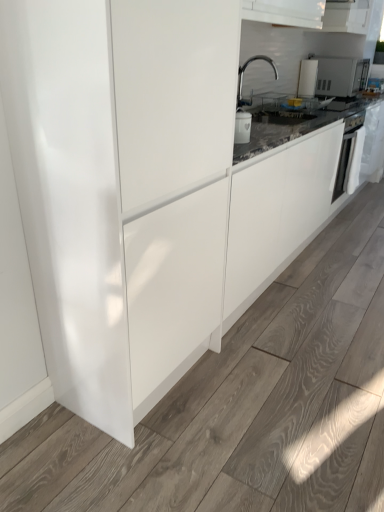
Measure the distance between point (303, 79) and camera.

They are 3.33 meters apart.

What do you see at coordinates (332, 75) in the screenshot? I see `white glossy microwave at upper right` at bounding box center [332, 75].

You are a GUI agent. You are given a task and a screenshot of the screen. Output one action in this format:
    pyautogui.click(x=<x>, y=<y>)
    Task: Click on the polished chrome faucet at upper center
    
    Given the screenshot: What is the action you would take?
    pyautogui.click(x=243, y=75)

At what (x,y) coordinates should I click in order to perform the action: click on white glossy oven at right. Please return your answer as a coordinate pair (x, y). Looking at the image, I should click on (346, 154).

What is the approximate width of glossy white cabinet at center?

A: It is 23.48 inches.

Locate an element on the screen. This screenshot has height=512, width=384. white glossy microwave at upper right is located at coordinates (307, 78).

Is polished chrome faucet at upper center oriented away from white glossy microwave at upper right?

polished chrome faucet at upper center is not turned away from white glossy microwave at upper right.

Is white glossy microwave at upper right a part of polished chrome faucet at upper center?

No, white glossy microwave at upper right is not surrounded by polished chrome faucet at upper center.

Considering the relative sizes of polished chrome faucet at upper center and white glossy microwave at upper right in the image provided, is polished chrome faucet at upper center bigger than white glossy microwave at upper right?

Yes.

Is white glossy microwave at upper right oriented towards glossy white cabinet at center?

No, white glossy microwave at upper right is not turned towards glossy white cabinet at center.

Can you confirm if white glossy microwave at upper right is shorter than glossy white cabinet at center?

Indeed, white glossy microwave at upper right has a lesser height compared to glossy white cabinet at center.

In the scene shown: How many degrees apart are the facing directions of white glossy microwave at upper right and glossy white cabinet at center?

There is a 1.13-degree angle between the facing directions of white glossy microwave at upper right and glossy white cabinet at center.

From the image's perspective, is white glossy microwave at upper right positioned above or below glossy white cabinet at center?

From the image's perspective, white glossy microwave at upper right appears above glossy white cabinet at center.

Considering their positions, is white glossy microwave at upper right located in front of or behind white glossy oven at right?

white glossy microwave at upper right is positioned farther from the viewer than white glossy oven at right.

Can you tell me how much white glossy microwave at upper right and white glossy oven at right differ in facing direction?

The facing directions of white glossy microwave at upper right and white glossy oven at right are 0.153 degrees apart.

Is white glossy microwave at upper right positioned far away from white glossy oven at right?

white glossy microwave at upper right is actually quite close to white glossy oven at right.

Could you tell me if white glossy microwave at upper right is facing white glossy oven at right?

No, white glossy microwave at upper right is not facing towards white glossy oven at right.

From the image's perspective, is glossy white cabinet at center above white glossy microwave at upper right?

No, from the image's perspective, glossy white cabinet at center is not above white glossy microwave at upper right.

Which of these two, glossy white cabinet at center or white glossy microwave at upper right, stands shorter?

white glossy microwave at upper right is shorter.

Identify the location of kitchen appliance that is above the glossy white cabinet at center (from a real-world perspective). This screenshot has height=512, width=384. (307, 78).

Is glossy white cabinet at center turned away from white glossy microwave at upper right?

No, glossy white cabinet at center is not facing away from white glossy microwave at upper right.

Considering the positions of point (332, 202) and point (346, 69), is point (332, 202) closer or farther from the camera than point (346, 69)?

Point (332, 202) appears to be closer to the viewer than point (346, 69).

From a real-world perspective, is white glossy oven at right physically above white glossy microwave at upper right?

No, from a real-world perspective, white glossy oven at right is not above white glossy microwave at upper right.

Is white glossy oven at right positioned far away from white glossy microwave at upper right?

white glossy oven at right is near white glossy microwave at upper right, not far away.

How different are the orientations of white glossy oven at right and white glossy microwave at upper right in degrees?

The facing directions of white glossy oven at right and white glossy microwave at upper right are 0.153 degrees apart.

Could you tell me if polished chrome faucet at upper center is facing white glossy oven at right?

No, polished chrome faucet at upper center is not aimed at white glossy oven at right.

The image size is (384, 512). Identify the location of home appliance on the right of polished chrome faucet at upper center. (346, 154).

From the image's perspective, is polished chrome faucet at upper center beneath white glossy oven at right?

No, from the image's perspective, polished chrome faucet at upper center is not below white glossy oven at right.

Locate an element on the screen. glass door that is on the left side of white glossy microwave at upper right is located at coordinates (70, 198).

Is white glossy microwave at upper right to the left of glossy white cabinet at center from the viewer's perspective?

No, white glossy microwave at upper right is not to the left of glossy white cabinet at center.

In terms of size, does white glossy microwave at upper right appear bigger or smaller than glossy white cabinet at center?

Considering their sizes, white glossy microwave at upper right takes up less space than glossy white cabinet at center.

Between white glossy microwave at upper right and glossy white cabinet at center, which one has smaller width?

Thinner between the two is white glossy microwave at upper right.

The image size is (384, 512). I want to click on tap that appears below the white glossy microwave at upper right (from the image's perspective), so click(x=243, y=75).

Locate an element on the screen. This screenshot has height=512, width=384. kitchen appliance located above the glossy white cabinet at center (from the image's perspective) is located at coordinates (307, 78).

Based on their spatial positions, is white glossy microwave at upper right or white glossy microwave at upper right further from polished chrome faucet at upper center?

white glossy microwave at upper right.

From the image, which object appears to be nearer to white glossy oven at right, polished chrome faucet at upper center or white glossy microwave at upper right?

The object closer to white glossy oven at right is white glossy microwave at upper right.

When comparing their distances from white glossy microwave at upper right, does polished chrome faucet at upper center or glossy white cabinet at center seem closer?

polished chrome faucet at upper center.

Considering their positions, is white glossy microwave at upper right positioned closer to polished chrome faucet at upper center than glossy white cabinet at center?

Among the two, white glossy microwave at upper right is located nearer to polished chrome faucet at upper center.

Based on their spatial positions, is white glossy microwave at upper right or polished chrome faucet at upper center further from white glossy microwave at upper right?

Among the two, polished chrome faucet at upper center is located further to white glossy microwave at upper right.

From the image, which object appears to be nearer to glossy white cabinet at center, white glossy microwave at upper right or white glossy microwave at upper right?

white glossy microwave at upper right is positioned closer to the anchor glossy white cabinet at center.

Considering their positions, is white glossy microwave at upper right positioned closer to glossy white cabinet at center than white glossy oven at right?

white glossy oven at right is closer to glossy white cabinet at center.

Looking at the image, which one is located closer to white glossy oven at right, white glossy microwave at upper right or glossy white cabinet at center?

Among the two, white glossy microwave at upper right is located nearer to white glossy oven at right.

In order to click on appliance between polished chrome faucet at upper center and white glossy microwave at upper right along the z-axis in this screenshot , I will do `click(332, 75)`.

Locate an element on the screen. tap between glossy white cabinet at center and white glossy microwave at upper right in the front-back direction is located at coordinates (243, 75).

This screenshot has width=384, height=512. Identify the location of kitchen appliance that lies between white glossy microwave at upper right and white glossy oven at right from top to bottom. (307, 78).

Identify the location of appliance between glossy white cabinet at center and white glossy microwave at upper right along the z-axis. The width and height of the screenshot is (384, 512). [332, 75].